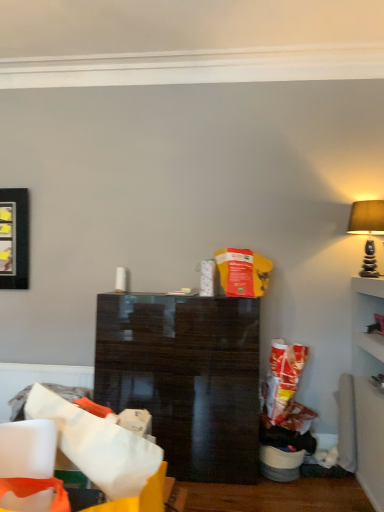
Question: Is glossy dark wood cabinet at center to the right of white paper bag at lower left from the viewer's perspective?

Choices:
 (A) yes
 (B) no

Answer: (A)

Question: Is glossy dark wood cabinet at center outside of white paper bag at lower left?

Choices:
 (A) yes
 (B) no

Answer: (A)

Question: From the image's perspective, is glossy dark wood cabinet at center below white paper bag at lower left?

Choices:
 (A) yes
 (B) no

Answer: (A)

Question: Is glossy dark wood cabinet at center taller than white paper bag at lower left?

Choices:
 (A) no
 (B) yes

Answer: (B)

Question: Is glossy dark wood cabinet at center thinner than white paper bag at lower left?

Choices:
 (A) no
 (B) yes

Answer: (A)

Question: Is glossy dark wood cabinet at center closer to camera compared to white paper bag at lower left?

Choices:
 (A) yes
 (B) no

Answer: (B)

Question: From a real-world perspective, is white paper bag at lower left beneath glossy dark wood cabinet at center?

Choices:
 (A) yes
 (B) no

Answer: (B)

Question: From a real-world perspective, is white paper bag at lower left on top of glossy dark wood cabinet at center?

Choices:
 (A) no
 (B) yes

Answer: (B)

Question: Is white paper bag at lower left not within glossy dark wood cabinet at center?

Choices:
 (A) yes
 (B) no

Answer: (A)

Question: Can you confirm if white paper bag at lower left is bigger than glossy dark wood cabinet at center?

Choices:
 (A) no
 (B) yes

Answer: (A)

Question: Is white paper bag at lower left to the right of glossy dark wood cabinet at center from the viewer's perspective?

Choices:
 (A) yes
 (B) no

Answer: (B)

Question: Is glossy dark wood cabinet at center located within white paper bag at lower left?

Choices:
 (A) no
 (B) yes

Answer: (A)

Question: Is matte beige lampshade at upper right aimed at glossy dark wood cabinet at center?

Choices:
 (A) no
 (B) yes

Answer: (A)